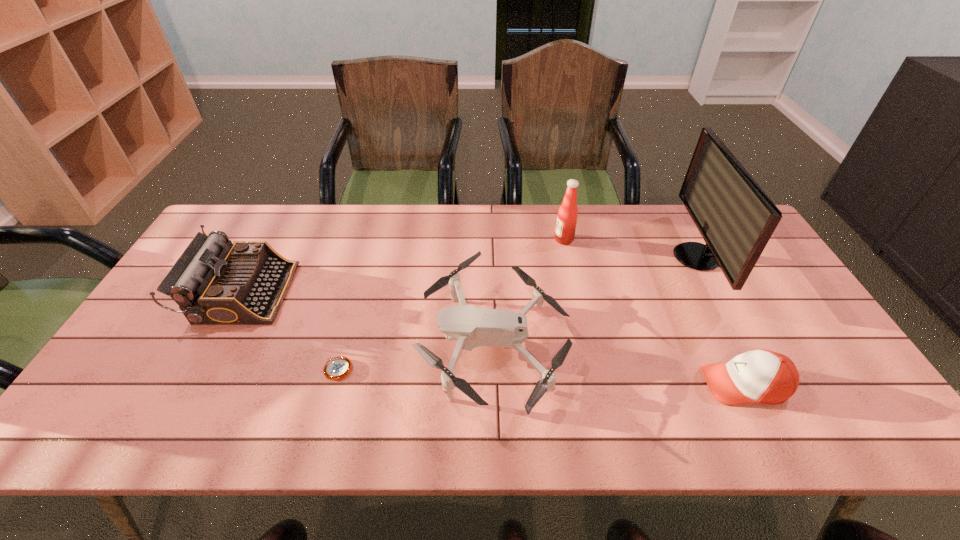
At what (x,y) coordinates should I click in order to perform the action: click on vacant point located on the front-facing side of the baseball cap. Please return your answer as a coordinate pair (x, y). Looking at the image, I should click on (537, 385).

The height and width of the screenshot is (540, 960). Find the location of `free region located on the front-facing side of the baseball cap`. free region located on the front-facing side of the baseball cap is located at coordinates (675, 385).

The width and height of the screenshot is (960, 540). In order to click on free spot located on the back of the second object from left to right in this screenshot , I will do `click(367, 266)`.

Find the location of a particular element. The width and height of the screenshot is (960, 540). computer monitor that is at the far edge is located at coordinates (735, 217).

Where is `condiment that is at the far edge`? The image size is (960, 540). condiment that is at the far edge is located at coordinates (567, 216).

Image resolution: width=960 pixels, height=540 pixels. In order to click on drone that is at the near edge in this screenshot , I will do `click(473, 327)`.

Find the location of a particular element. Image resolution: width=960 pixels, height=540 pixels. baseball cap that is at the near edge is located at coordinates (763, 376).

Where is `object that is at the left edge`? The image size is (960, 540). object that is at the left edge is located at coordinates (214, 282).

This screenshot has height=540, width=960. I want to click on computer monitor at the right edge, so click(x=735, y=217).

In order to click on baseball cap that is at the right edge in this screenshot , I will do `click(763, 376)`.